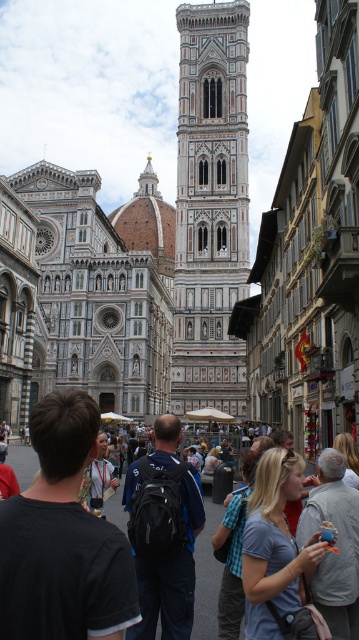
Question: Which object appears closest to the camera in this image?

Choices:
 (A) matte black backpack at center
 (B) blue cotton shirt at center

Answer: (A)

Question: Does black fabric backpack at center have a lesser width compared to blue plaid shirt at center?

Choices:
 (A) yes
 (B) no

Answer: (B)

Question: Observing the image, what is the correct spatial positioning of gray stone bell tower at center in reference to blue plaid shirt at center?

Choices:
 (A) above
 (B) below

Answer: (A)

Question: Which of the following is the closest to the observer?

Choices:
 (A) black fabric backpack at center
 (B) matte black backpack at center
 (C) white marble cathedral at center
 (D) matte gray backpack at lower right

Answer: (A)

Question: Can you confirm if white marble cathedral at center is positioned below matte gray backpack at lower right?

Choices:
 (A) no
 (B) yes

Answer: (A)

Question: Which point appears farthest from the camera in this image?

Choices:
 (A) (53, 588)
 (B) (230, 538)
 (C) (103, 468)

Answer: (C)